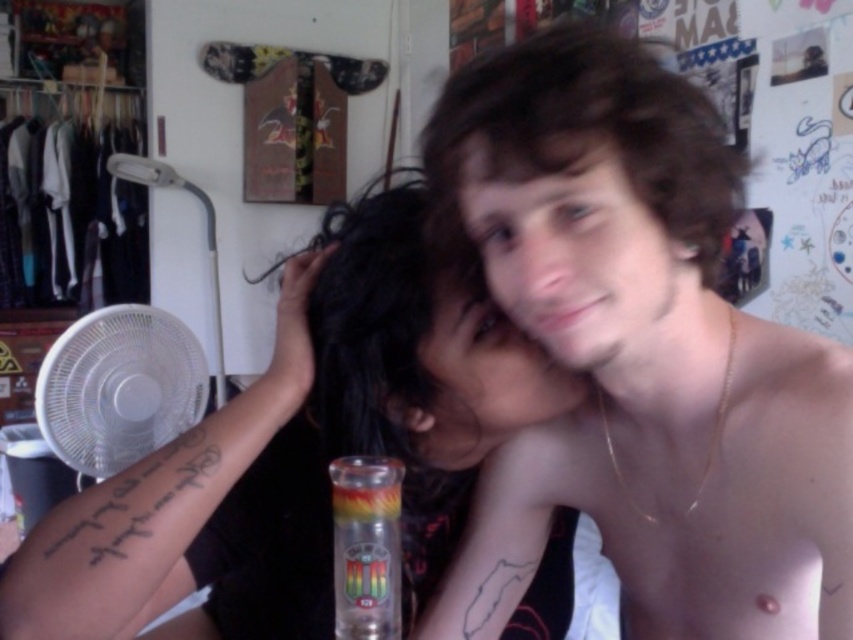
Between shiny gold necklace at upper right and dark curly hair at center, which one is positioned higher?

Positioned higher is dark curly hair at center.

Is point (520, 563) positioned in front of point (511, 97)?

No, (520, 563) is further to viewer.

Is point (720, 419) positioned in front of point (566, 83)?

No, it is behind (566, 83).

Find the location of a particular element. The image size is (853, 640). shiny gold necklace at upper right is located at coordinates (x=640, y=356).

Can you confirm if dark curly hair at center is taller than black tattooed arm at left?

In fact, dark curly hair at center may be shorter than black tattooed arm at left.

You are a GUI agent. You are given a task and a screenshot of the screen. Output one action in this format:
    pyautogui.click(x=<x>, y=<y>)
    Task: Click on the dark curly hair at center
    Image resolution: width=853 pixels, height=640 pixels.
    Given the screenshot: What is the action you would take?
    pyautogui.click(x=584, y=134)

Locate an element on the screen. The image size is (853, 640). dark curly hair at center is located at coordinates (584, 134).

Which is in front, point (703, 348) or point (399, 573)?

Point (703, 348) is more forward.

Who is more distant from viewer, (x=531, y=326) or (x=337, y=508)?

Point (x=337, y=508)

Where is `shiny gold necklace at upper right`? This screenshot has height=640, width=853. shiny gold necklace at upper right is located at coordinates (640, 356).

Image resolution: width=853 pixels, height=640 pixels. In order to click on shiny gold necklace at upper right in this screenshot , I will do `click(640, 356)`.